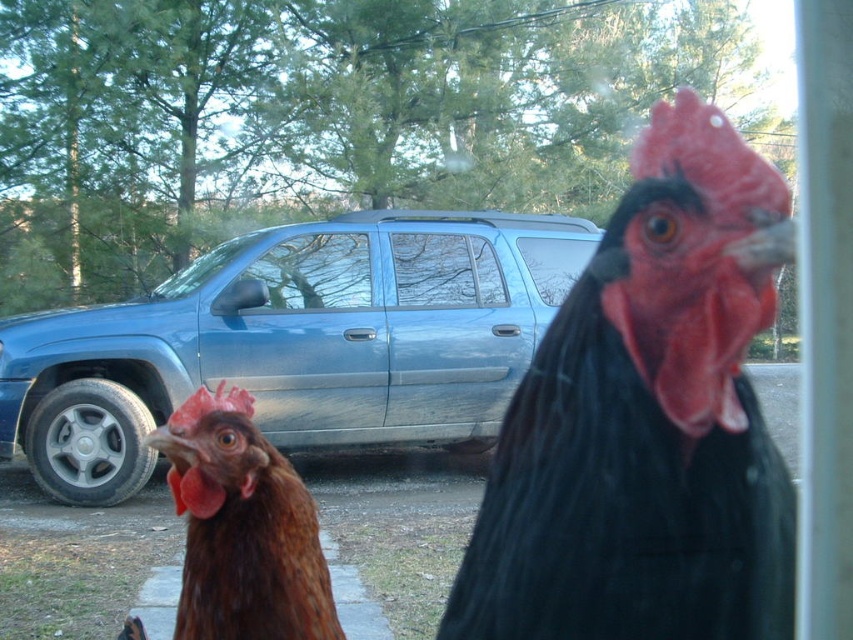
Looking at this image, who is positioned more to the left, black glossy rooster at center or brown feathered chicken at lower left?

brown feathered chicken at lower left is more to the left.

Does point (782, 202) come farther from viewer compared to point (199, 552)?

No, (782, 202) is in front of (199, 552).

Where is `black glossy rooster at center`? Image resolution: width=853 pixels, height=640 pixels. black glossy rooster at center is located at coordinates (647, 420).

At what (x,y) coordinates should I click in order to perform the action: click on black glossy rooster at center. Please return your answer as a coordinate pair (x, y). This screenshot has width=853, height=640. Looking at the image, I should click on (647, 420).

Between black glossy rooster at center and blue metallic car at center, which one is positioned higher?

Positioned higher is black glossy rooster at center.

The width and height of the screenshot is (853, 640). What are the coordinates of `black glossy rooster at center` in the screenshot? It's located at (647, 420).

Between blue metallic car at center and brown feathered chicken at lower left, which one appears on the left side from the viewer's perspective?

From the viewer's perspective, blue metallic car at center appears more on the left side.

Is blue metallic car at center smaller than brown feathered chicken at lower left?

Incorrect, blue metallic car at center is not smaller in size than brown feathered chicken at lower left.

What do you see at coordinates (294, 342) in the screenshot? I see `blue metallic car at center` at bounding box center [294, 342].

You are a GUI agent. You are given a task and a screenshot of the screen. Output one action in this format:
    pyautogui.click(x=<x>, y=<y>)
    Task: Click on the blue metallic car at center
    The image size is (853, 640).
    Given the screenshot: What is the action you would take?
    pyautogui.click(x=294, y=342)